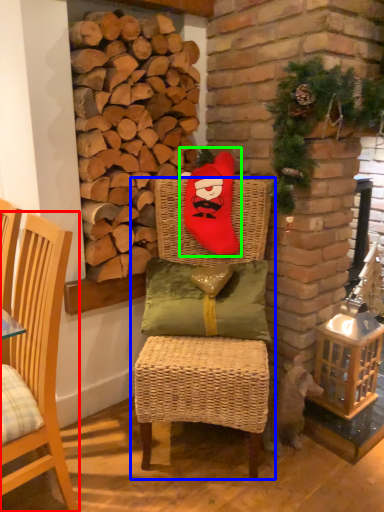
Question: Considering the real-world distances, which object is closest to chair (highlighted by a red box)? chair (highlighted by a blue box) or santa claus (highlighted by a green box).

Choices:
 (A) chair
 (B) santa claus

Answer: (A)